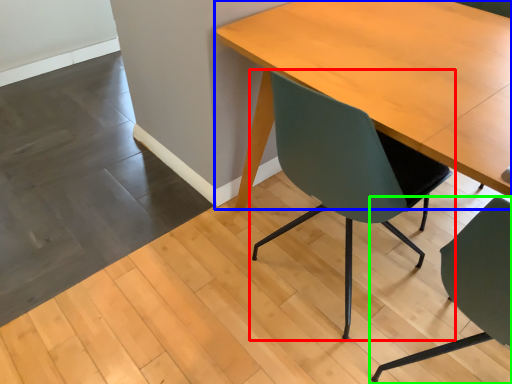
Question: Which is farther away from chair (highlighted by a red box)? table (highlighted by a blue box) or chair (highlighted by a green box)?

Choices:
 (A) table
 (B) chair

Answer: (B)